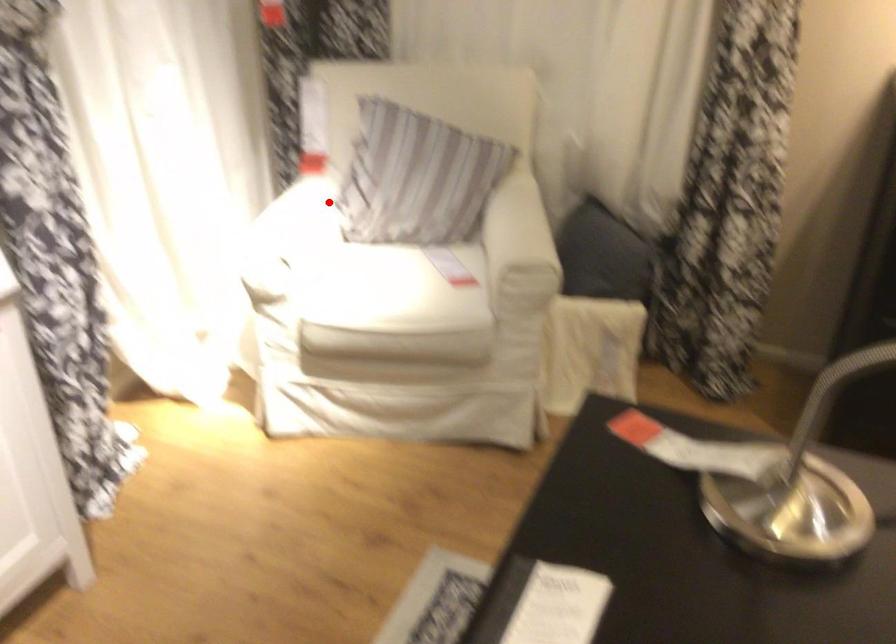
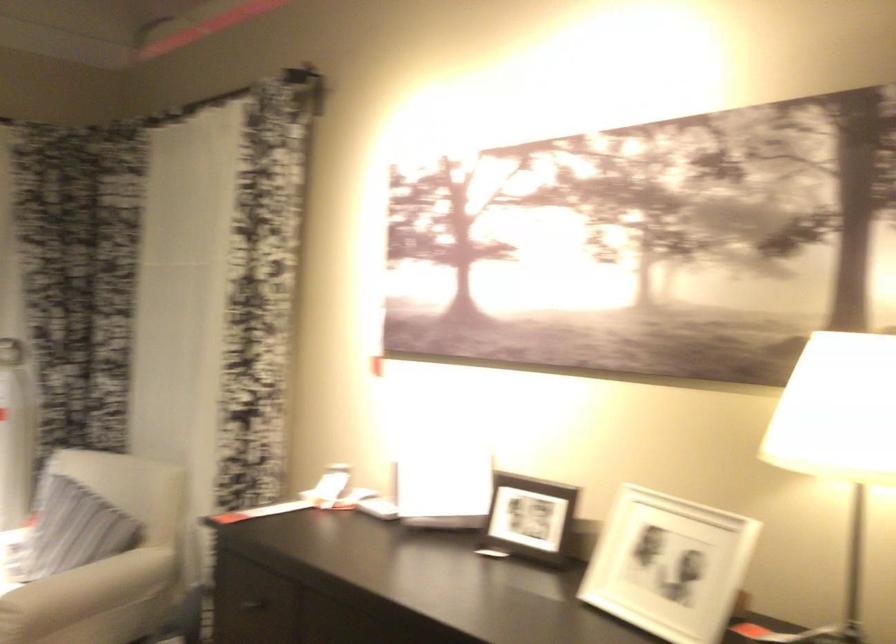
Question: I am providing you with two images of the same scene from different viewpoints. A red point is marked on the first image. At the location where the point appears in image 1, is it still visible in image 2?

Choices:
 (A) Yes
 (B) No

Answer: (A)